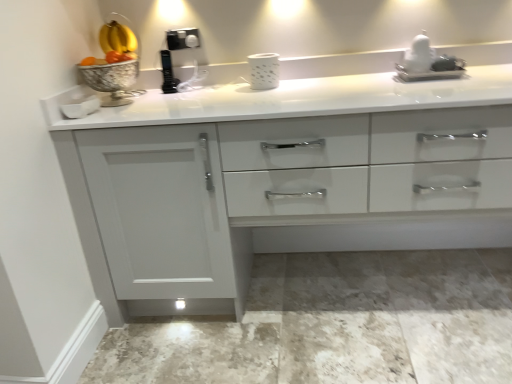
The width and height of the screenshot is (512, 384). In order to click on vacant space underneath white glossy countertop at center (from a real-world perspective) in this screenshot , I will do `click(351, 293)`.